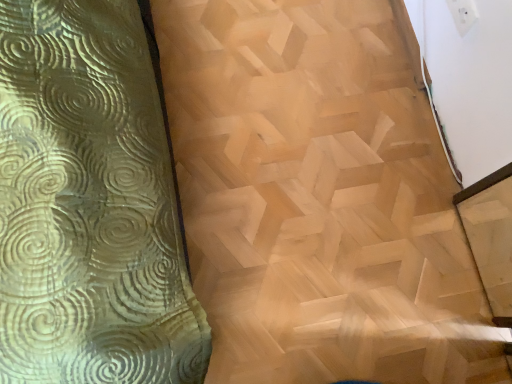
Image resolution: width=512 pixels, height=384 pixels. What do you see at coordinates (318, 198) in the screenshot? I see `natural wood parquet floor at center` at bounding box center [318, 198].

This screenshot has width=512, height=384. Find the location of `natural wood parquet floor at center`. natural wood parquet floor at center is located at coordinates (318, 198).

Identify the location of natural wood parquet floor at center. This screenshot has width=512, height=384. (318, 198).